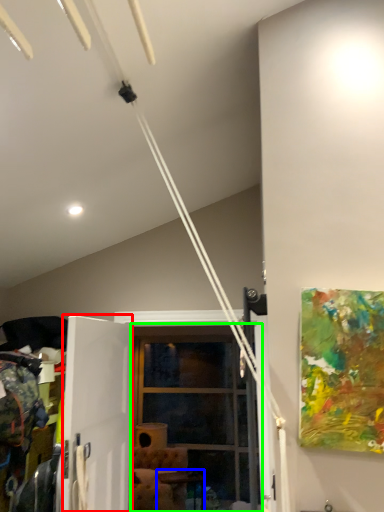
Question: Which object is the farthest from screen door (highlighted by a red box)? Choose among these: table (highlighted by a blue box) or glass door (highlighted by a green box).

Choices:
 (A) table
 (B) glass door

Answer: (A)